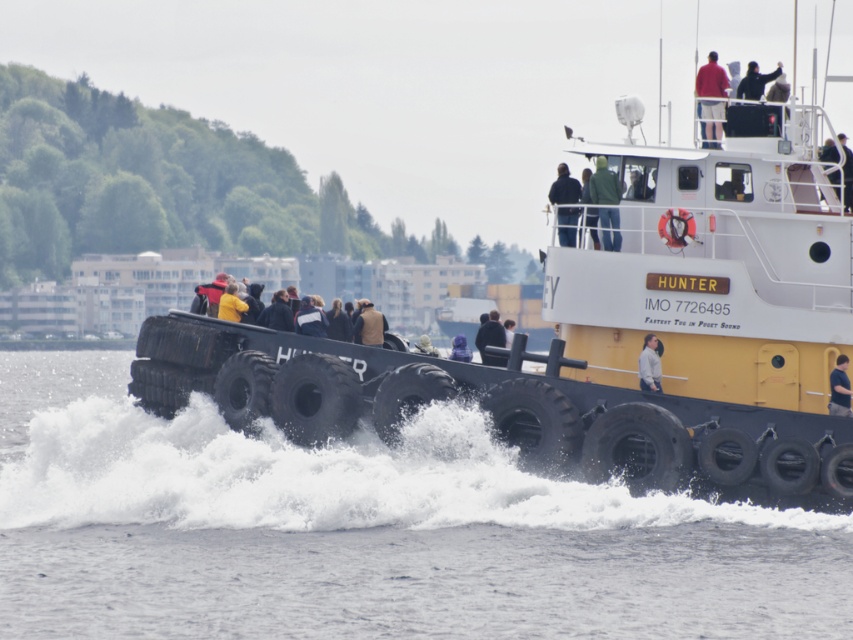
Question: Which of these objects is positioned closest to the light gray fabric jacket at center?

Choices:
 (A) dark blue shirt at upper right
 (B) yellow jacket at center
 (C) purple fabric at center
 (D) brown leather jacket at center

Answer: (A)

Question: Which object is closer to the camera taking this photo?

Choices:
 (A) black matte jacket at upper right
 (B) light brown leather jacket at center
 (C) green matte jacket at upper center

Answer: (C)

Question: Does light gray fabric jacket at center have a larger size compared to black matte jacket at upper right?

Choices:
 (A) yes
 (B) no

Answer: (B)

Question: Can you confirm if yellow jacket at center is wider than light gray fabric jacket at center?

Choices:
 (A) no
 (B) yes

Answer: (B)

Question: Based on their relative distances, which object is farther from the green fabric jacket at upper center?

Choices:
 (A) black rubber tires at lower center
 (B) white frothy water at lower center
 (C) green matte jacket at upper center
 (D) brown leather jacket at center

Answer: (B)

Question: Is matte red shirt at upper center below green matte jacket at upper center?

Choices:
 (A) no
 (B) yes

Answer: (A)